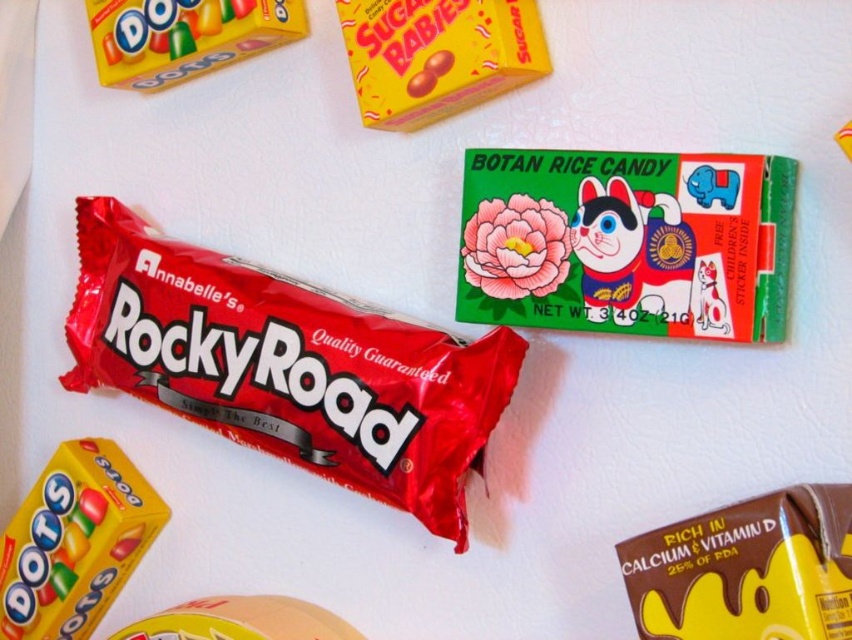
From the picture: Between shiny red chocolate bar at center and yellow matte candy at lower left, which one is positioned higher?

shiny red chocolate bar at center

From the picture: Between shiny red chocolate bar at center and yellow matte candy at lower left, which one has less height?

With less height is yellow matte candy at lower left.

Who is more forward, (x=87, y=296) or (x=118, y=545)?

Point (x=118, y=545) is in front.

At what (x,y) coordinates should I click in order to perform the action: click on shiny red chocolate bar at center. Please return your answer as a coordinate pair (x, y). The image size is (852, 640). Looking at the image, I should click on (286, 365).

Which of these two, yellow matte candy at lower left or yellow matte candy at upper center, stands shorter?

With less height is yellow matte candy at upper center.

Is yellow matte candy at lower left above yellow matte candy at upper center?

Actually, yellow matte candy at lower left is below yellow matte candy at upper center.

This screenshot has height=640, width=852. In order to click on yellow matte candy at lower left in this screenshot , I will do `click(73, 541)`.

Identify the location of yellow matte candy at lower left. (73, 541).

Consider the image. Is green paper botan rice candy at upper center wider than yellow matte candy at upper center?

Indeed, green paper botan rice candy at upper center has a greater width compared to yellow matte candy at upper center.

The width and height of the screenshot is (852, 640). In order to click on green paper botan rice candy at upper center in this screenshot , I will do `click(626, 243)`.